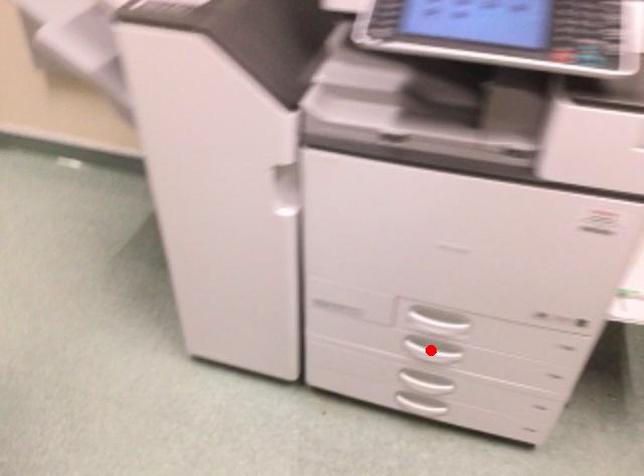
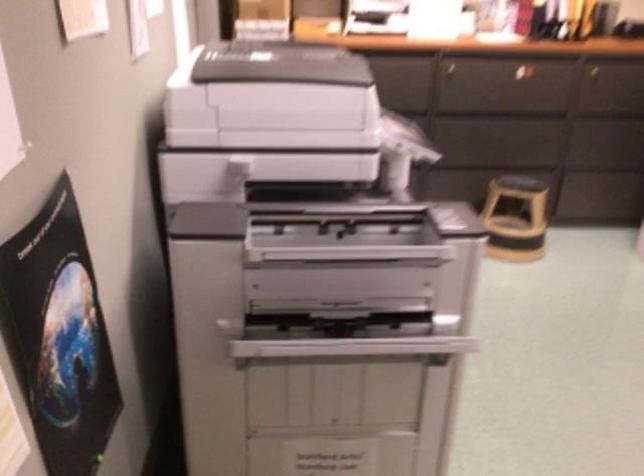
Question: I am providing you with two images of the same scene from different viewpoints. A red point is marked on the first image. Is the red point's position out of view in image 2?

Choices:
 (A) Yes
 (B) No

Answer: (A)